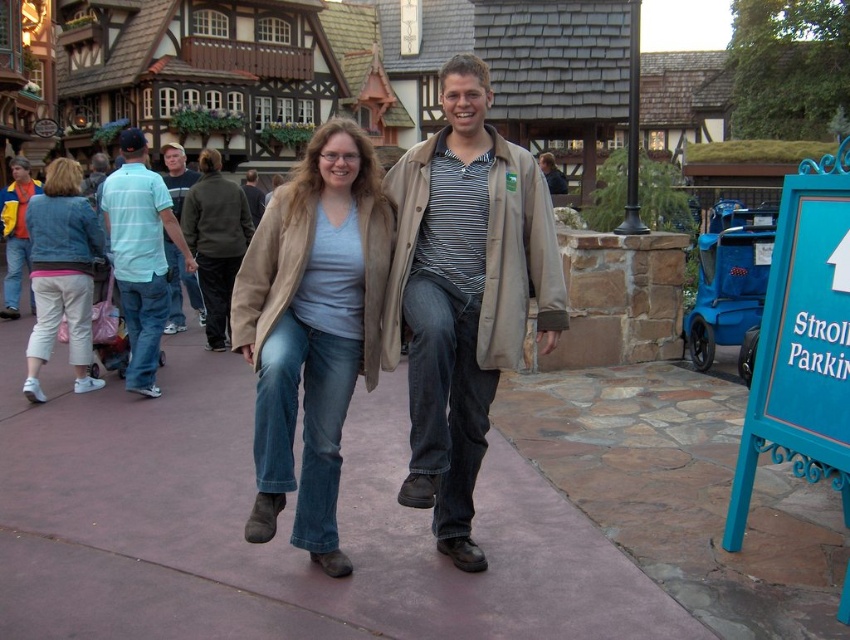
Question: Is pink concrete sidewalk at center above brushed metal jacket at left?

Choices:
 (A) yes
 (B) no

Answer: (B)

Question: Estimate the real-world distances between objects in this image. Which object is farther from the dark brown leather jacket at center?

Choices:
 (A) dark blue jeans at center
 (B) pink concrete sidewalk at center
 (C) light blue striped polo shirt at left
 (D) denim pants at left

Answer: (B)

Question: Is beige fabric coat at center closer to camera compared to blue painted wood sign at lower right?

Choices:
 (A) yes
 (B) no

Answer: (B)

Question: Which object is the closest to the denim pants at left?

Choices:
 (A) light blue shirt at center
 (B) dark blue jeans at center
 (C) dark brown leather jacket at center

Answer: (C)

Question: Is blue painted wood sign at lower right to the right of light blue shirt at center from the viewer's perspective?

Choices:
 (A) yes
 (B) no

Answer: (A)

Question: Estimate the real-world distances between objects in this image. Which object is closer to the pink concrete sidewalk at center?

Choices:
 (A) light blue denim jeans at center
 (B) dark brown leather jacket at center
 (C) brushed metal jacket at left
 (D) dark blue jeans at center

Answer: (A)